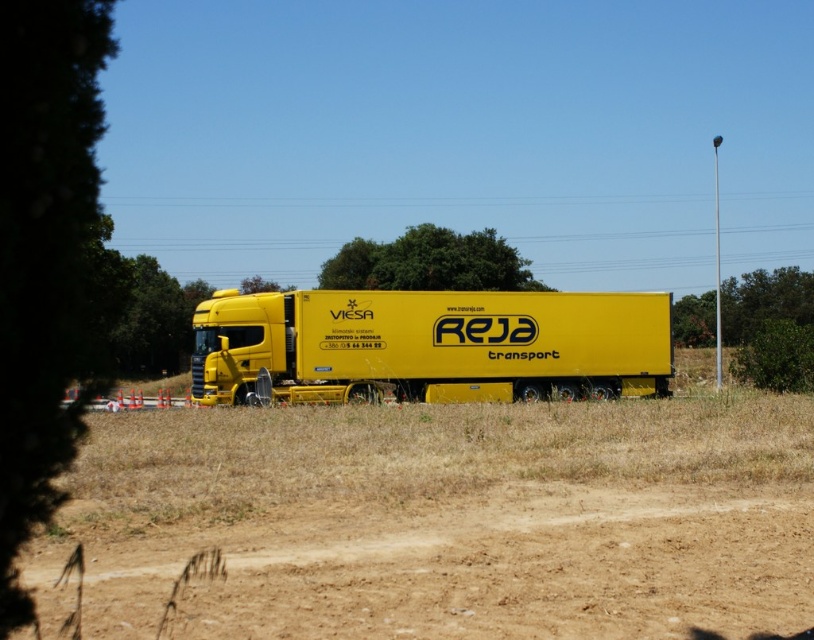
Question: Does green leafy tree at left have a greater width compared to green leafy tree at right?

Choices:
 (A) yes
 (B) no

Answer: (B)

Question: Which object is farther from the camera taking this photo?

Choices:
 (A) green leafy tree at right
 (B) yellow matte trailer truck at center

Answer: (A)

Question: Is yellow matte trailer truck at center behind green leafy tree at left?

Choices:
 (A) no
 (B) yes

Answer: (A)

Question: Which of the following is the farthest from the observer?

Choices:
 (A) (198, 378)
 (B) (432, 285)

Answer: (B)

Question: Does yellow matte trailer truck at center appear under green leafy tree at right?

Choices:
 (A) no
 (B) yes

Answer: (B)

Question: Which of the following is the closest to the observer?

Choices:
 (A) green leafy tree at right
 (B) green leafy tree at left
 (C) yellow matte trailer truck at center
 (D) dull brown dirt at center

Answer: (D)